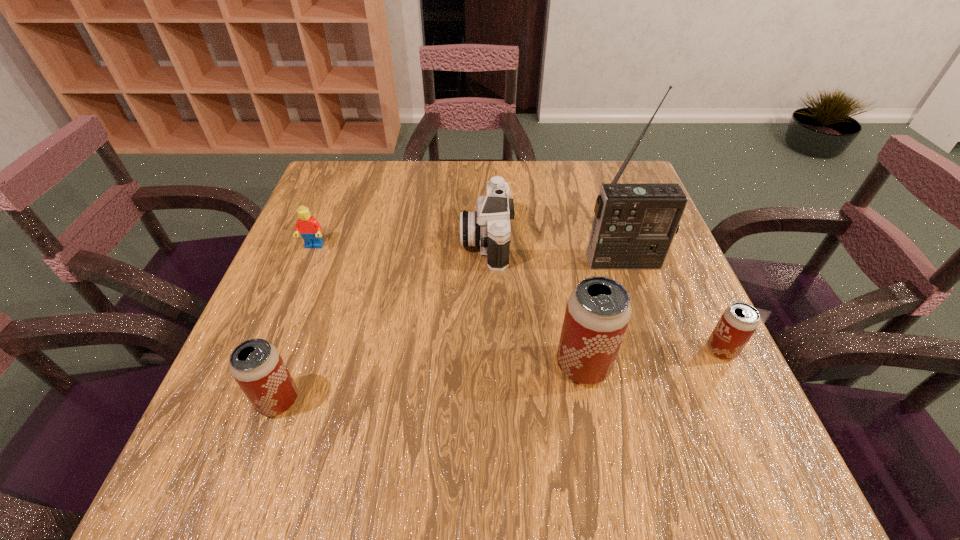
You are a GUI agent. You are given a task and a screenshot of the screen. Output one action in this format:
    pyautogui.click(x=<x>, y=<y>)
    Task: Click on the free space that satisfies the following two spatial constraints: 1. on the face of the Lego; 2. on the left side of the second shortest beer can
    The width and height of the screenshot is (960, 540).
    Given the screenshot: What is the action you would take?
    pyautogui.click(x=252, y=401)

Identify the location of free space that satisfies the following two spatial constraints: 1. on the back side of the fifth shortest object; 2. on the left side of the rightmost object. (580, 350).

Locate an element on the screen. vacant region that satisfies the following two spatial constraints: 1. on the display of the rightmost beer can; 2. on the left side of the fifth object from left to right is located at coordinates (654, 350).

The width and height of the screenshot is (960, 540). Find the location of `free spot that satisfies the following two spatial constraints: 1. on the face of the third object from right to left; 2. on the right side of the Lego`. free spot that satisfies the following two spatial constraints: 1. on the face of the third object from right to left; 2. on the right side of the Lego is located at coordinates (266, 366).